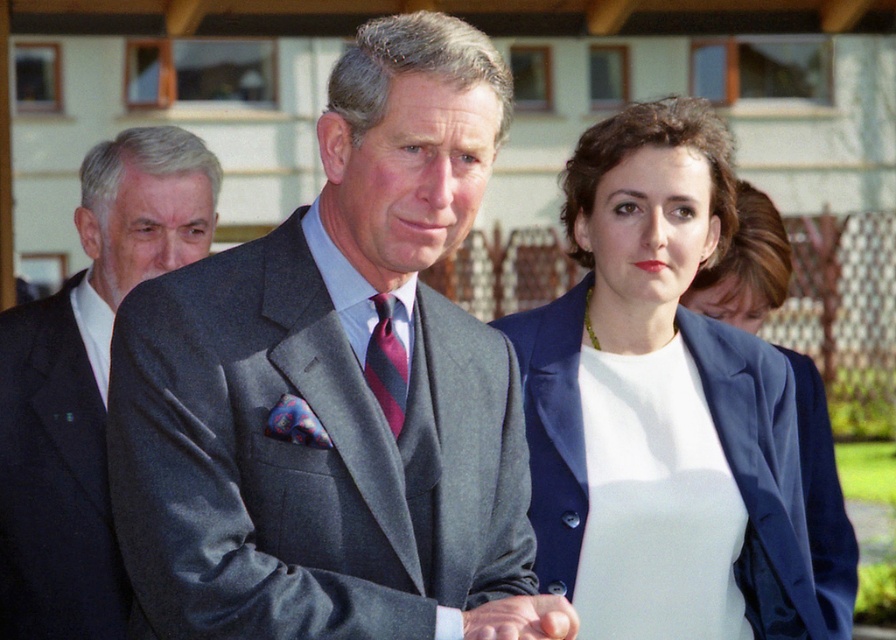
Between gray wool suit at center and smooth skin hand at center, which one is positioned lower?

Positioned lower is smooth skin hand at center.

Measure the distance between gray wool suit at center and smooth skin hand at center.

gray wool suit at center and smooth skin hand at center are 39.36 centimeters apart from each other.

Locate an element on the screen. gray wool suit at center is located at coordinates (332, 384).

Locate an element on the screen. This screenshot has height=640, width=896. gray wool suit at center is located at coordinates (332, 384).

Does satin blue blazer at center have a lesser height compared to smooth skin hand at center?

No.

Is satin blue blazer at center above smooth skin hand at center?

Correct, satin blue blazer at center is located above smooth skin hand at center.

Identify the location of satin blue blazer at center. (659, 404).

Who is positioned more to the left, white matte dress at center or navy blue fabric suit at right?

From the viewer's perspective, white matte dress at center appears more on the left side.

Measure the distance between white matte dress at center and camera.

white matte dress at center is 19.30 feet from camera.

Image resolution: width=896 pixels, height=640 pixels. Find the location of `white matte dress at center`. white matte dress at center is located at coordinates (655, 502).